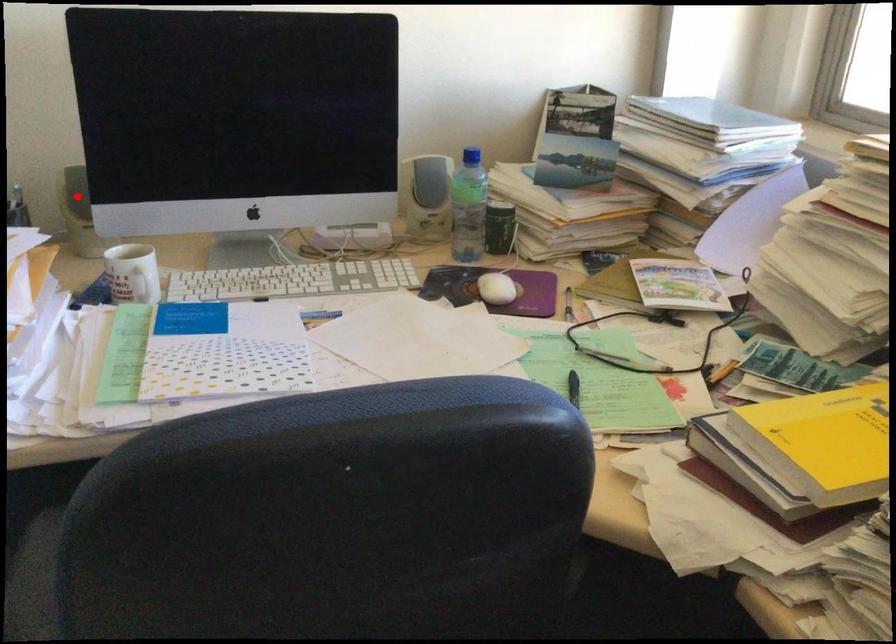
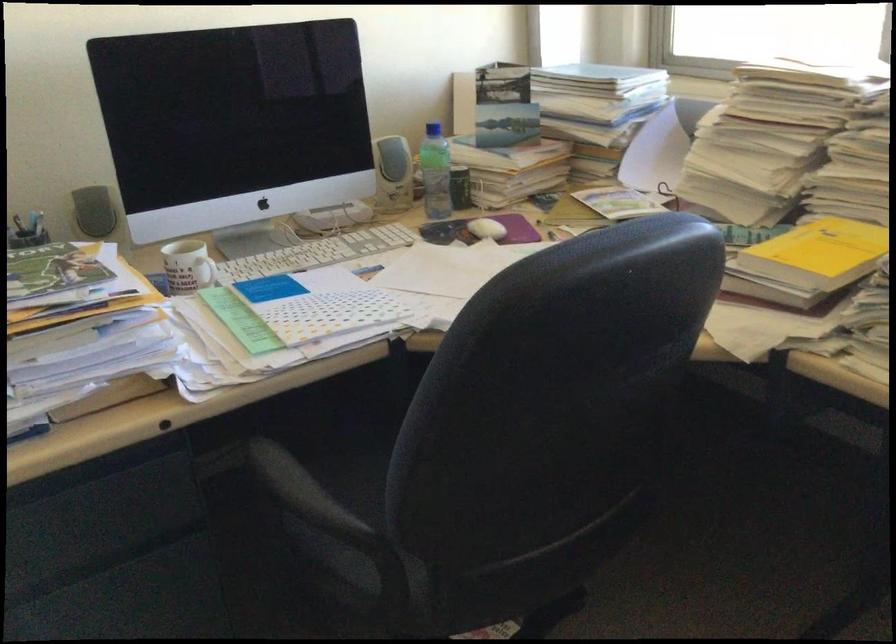
Find the pixel in the second image that matches the highlighted location in the first image.

(93, 211)